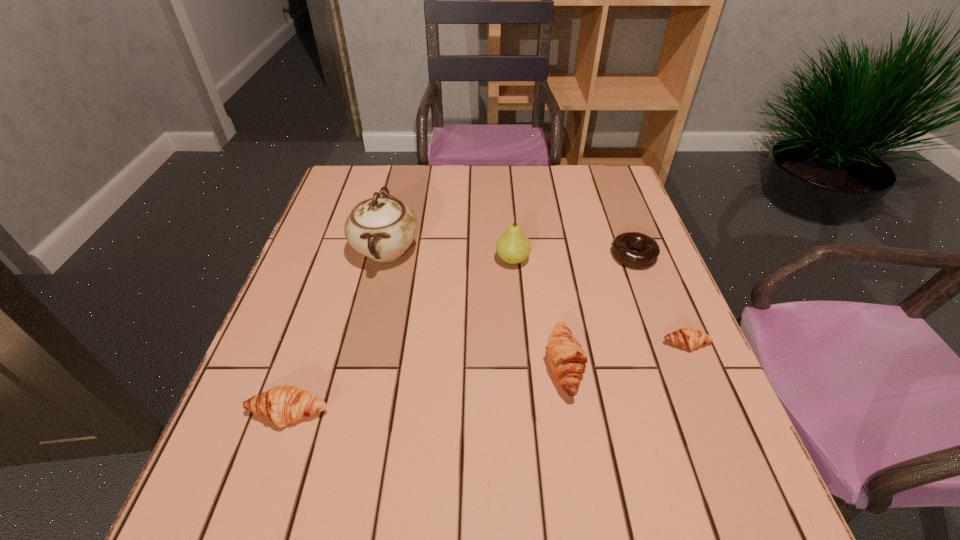
Locate an element on the screen. The image size is (960, 540). vacant space at the near edge is located at coordinates (438, 422).

Locate an element on the screen. vacant area at the left edge is located at coordinates (275, 329).

Where is `vacant area at the right edge`? This screenshot has width=960, height=540. vacant area at the right edge is located at coordinates (644, 313).

What are the coordinates of `vacant space at the far right corner of the desktop` in the screenshot? It's located at [x=613, y=207].

At what (x,y) coordinates should I click in order to perform the action: click on free space between the doughnut and the leftmost pastry. Please return your answer as a coordinate pair (x, y). The width and height of the screenshot is (960, 540). Looking at the image, I should click on (462, 334).

Locate an element on the screen. The height and width of the screenshot is (540, 960). empty location between the third object from right to left and the fifth shortest object is located at coordinates point(539,312).

Identify the location of empty space that is in between the third object from right to left and the doughnut. (599, 310).

The image size is (960, 540). Find the location of `empty location between the rightmost pastry and the second pastry from left to right`. empty location between the rightmost pastry and the second pastry from left to right is located at coordinates (626, 354).

Locate an element on the screen. This screenshot has height=540, width=960. vacant space in between the second shortest pastry and the rightmost pastry is located at coordinates (488, 379).

At what (x,y) coordinates should I click in order to perform the action: click on free space between the doughnut and the rightmost pastry. Please return your answer as a coordinate pair (x, y). Image resolution: width=960 pixels, height=540 pixels. Looking at the image, I should click on (660, 300).